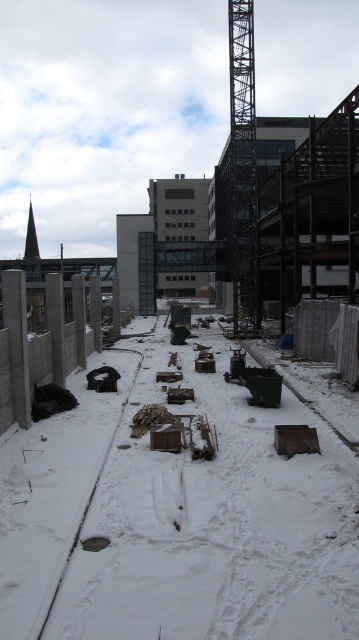
Is black metal crane at center positioned in front of black rubber train track at lower left?

No, black metal crane at center is further to the viewer.

Between black metal crane at center and black rubber train track at lower left, which one has more height?

Standing taller between the two is black metal crane at center.

Is point (244, 172) positioned before point (105, 445)?

No.

Where is `black metal crane at center`? This screenshot has width=359, height=640. black metal crane at center is located at coordinates (243, 164).

Is rusty metal debris at center to the left of black metal crane at center from the viewer's perspective?

Correct, you'll find rusty metal debris at center to the left of black metal crane at center.

Image resolution: width=359 pixels, height=640 pixels. What do you see at coordinates (174, 520) in the screenshot?
I see `rusty metal debris at center` at bounding box center [174, 520].

Find the location of a particular element. Image resolution: width=359 pixels, height=640 pixels. rusty metal debris at center is located at coordinates (174, 520).

Which of these two, concrete at left or black rubber train track at lower left, stands shorter?

black rubber train track at lower left

Locate an element on the screen. The height and width of the screenshot is (640, 359). concrete at left is located at coordinates (16, 342).